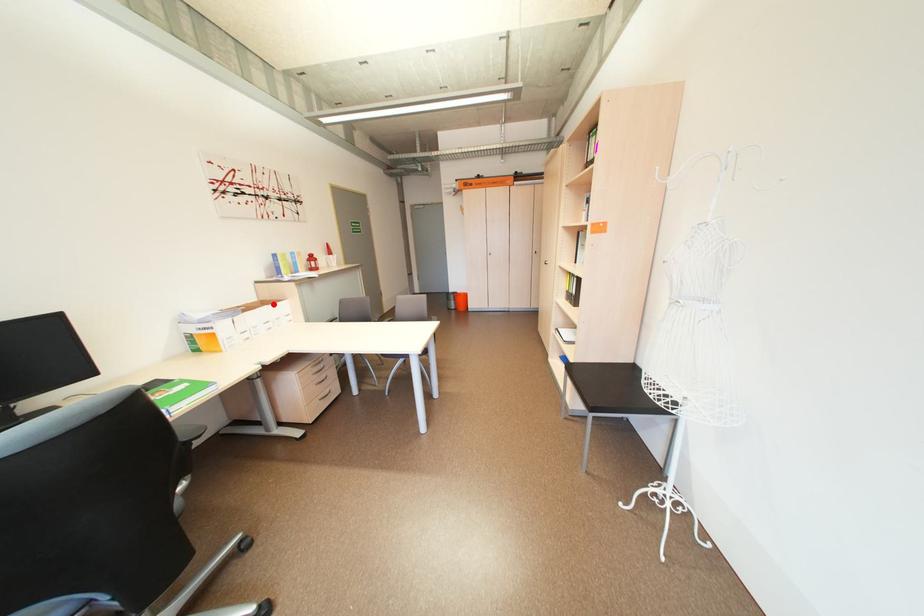
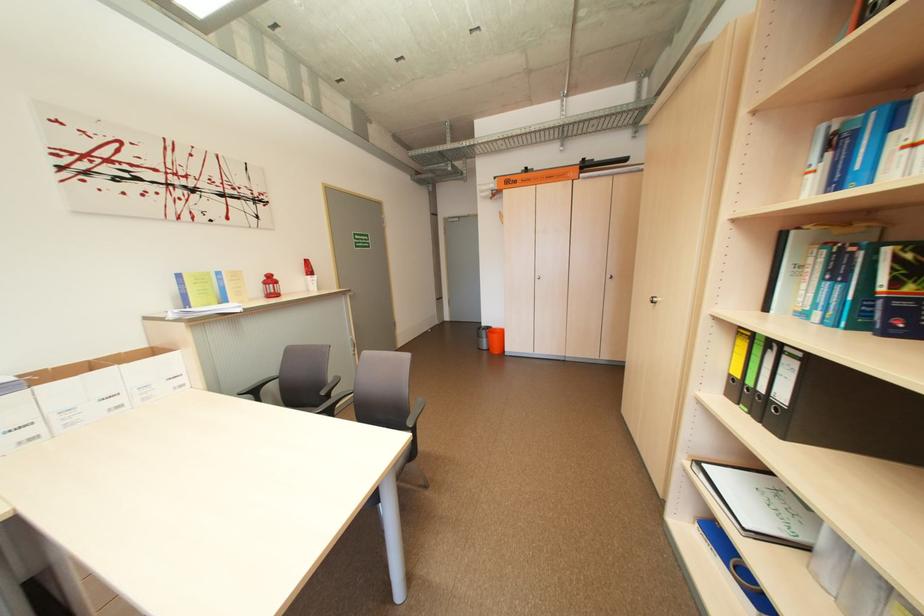
Find the pixel in the second image that matches the highlighted location in the first image.

(163, 353)